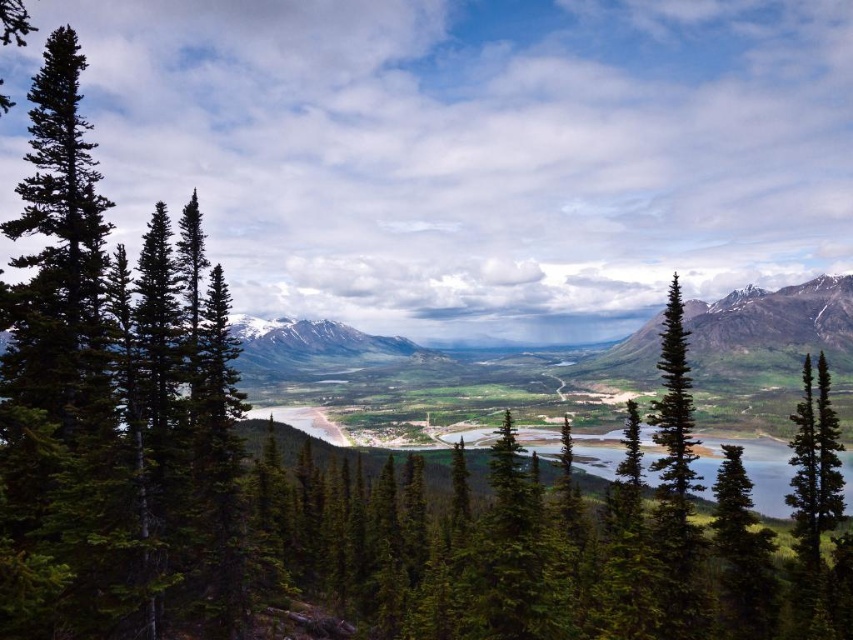
Is green matte tree at center bigger than snowy granite mountain at center?

No.

Measure the distance between green matte tree at center and camera.

green matte tree at center is 48.94 meters away from camera.

This screenshot has width=853, height=640. I want to click on green matte tree at center, so click(814, 465).

Does snowy granite mountain at upper right appear on the right side of snowy granite mountain at center?

Correct, you'll find snowy granite mountain at upper right to the right of snowy granite mountain at center.

Is snowy granite mountain at upper right wider than snowy granite mountain at center?

Incorrect, snowy granite mountain at upper right's width does not surpass snowy granite mountain at center's.

Who is more distant from viewer, (616, 378) or (340, 342)?

Positioned behind is point (340, 342).

The height and width of the screenshot is (640, 853). I want to click on snowy granite mountain at upper right, so coord(770,326).

Which is below, green matte tree at left or green matte tree at center?

green matte tree at center

The height and width of the screenshot is (640, 853). What do you see at coordinates (74, 381) in the screenshot?
I see `green matte tree at left` at bounding box center [74, 381].

You are a GUI agent. You are given a task and a screenshot of the screen. Output one action in this format:
    pyautogui.click(x=<x>, y=<y>)
    Task: Click on the green matte tree at left
    
    Given the screenshot: What is the action you would take?
    pyautogui.click(x=74, y=381)